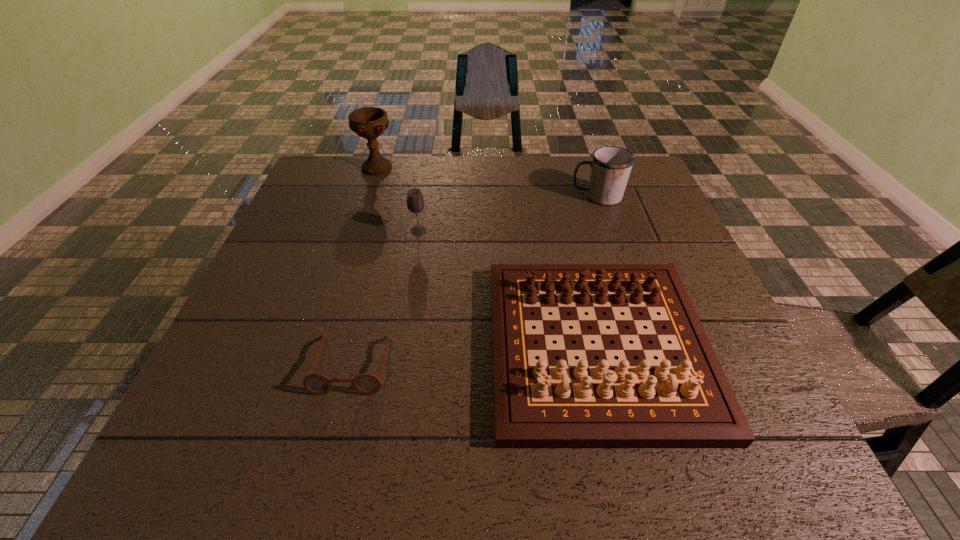
Where is `object located in the near right corner section of the desktop`? This screenshot has height=540, width=960. object located in the near right corner section of the desktop is located at coordinates (686, 403).

Identify the location of vacant area at the far edge of the desktop. This screenshot has width=960, height=540. (405, 173).

In the image, there is a desktop. Where is `vacant space at the near edge`? The image size is (960, 540). vacant space at the near edge is located at coordinates (490, 445).

Locate an element on the screen. This screenshot has height=540, width=960. vacant region at the left edge of the desktop is located at coordinates (326, 239).

Image resolution: width=960 pixels, height=540 pixels. In order to click on free space at the right edge in this screenshot , I will do `click(721, 326)`.

Where is `vacant space at the far left corner of the desktop`? This screenshot has height=540, width=960. vacant space at the far left corner of the desktop is located at coordinates (339, 195).

Image resolution: width=960 pixels, height=540 pixels. Identify the location of vacant area at the near left corner. (185, 433).

Where is `vacant space at the near right corner of the desktop`? This screenshot has height=540, width=960. vacant space at the near right corner of the desktop is located at coordinates (708, 474).

The width and height of the screenshot is (960, 540). In order to click on vacant space that is in between the chalice and the third nearest object in this screenshot , I will do `click(398, 199)`.

This screenshot has width=960, height=540. I want to click on empty space between the farthest object and the third farthest object, so click(398, 199).